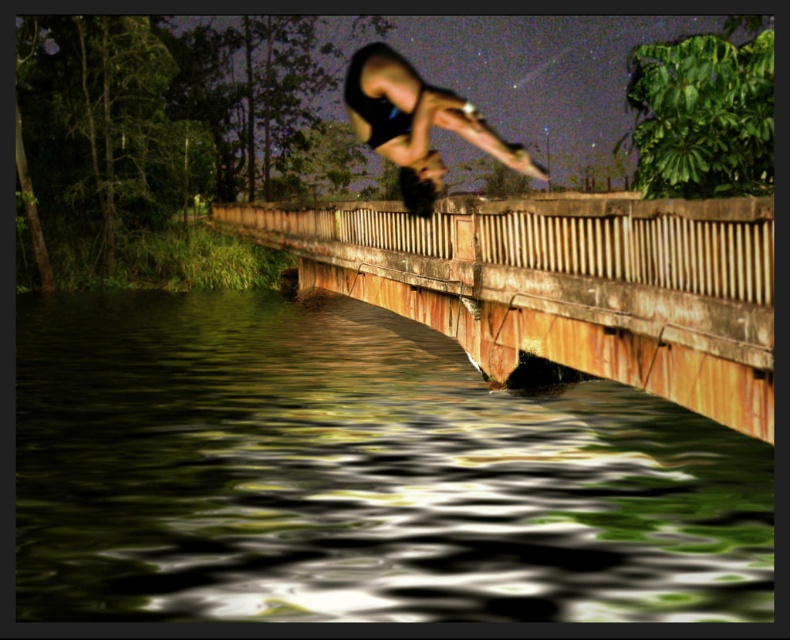
Does green reflective water at lower left have a lesser width compared to rusty metal bridge at center?

Incorrect, green reflective water at lower left's width is not less than rusty metal bridge at center's.

Which is behind, point (693, 474) or point (596, 266)?

The point (596, 266) is behind.

Between point (299, 337) and point (273, 230), which one is positioned in front?

Positioned in front is point (299, 337).

You are a GUI agent. You are given a task and a screenshot of the screen. Output one action in this format:
    pyautogui.click(x=<x>, y=<y>)
    Task: Click on the green reflective water at lower left
    The height and width of the screenshot is (640, 790).
    Given the screenshot: What is the action you would take?
    pyautogui.click(x=356, y=476)

Is rusty metal bridge at center behind black matte man at center?

Yes, rusty metal bridge at center is further from the viewer.

Which is above, rusty metal bridge at center or black matte man at center?

black matte man at center

This screenshot has width=790, height=640. In order to click on rusty metal bridge at center in this screenshot , I will do `click(562, 284)`.

Who is more forward, (61, 412) or (427, 154)?

Point (427, 154) is in front.

Can you confirm if green reflective water at lower left is smaller than black matte man at center?

No.

Between point (476, 506) and point (435, 188), which one is positioned in front?

Positioned in front is point (476, 506).

Find the location of a particular element. This screenshot has width=790, height=640. green reflective water at lower left is located at coordinates (356, 476).